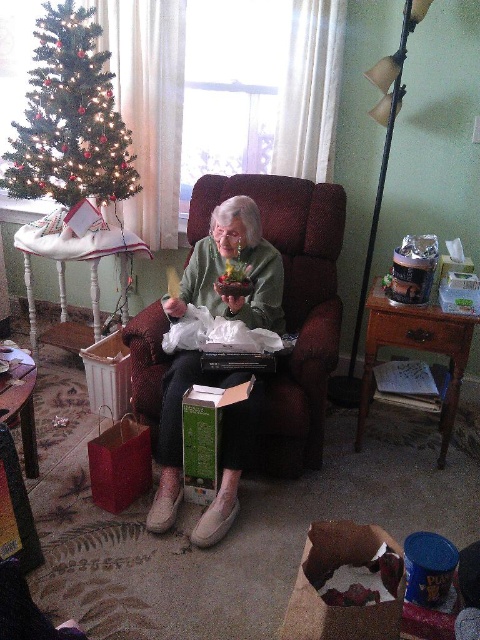
Is brown paper bag at lower center further to the viewer compared to white wood stool at left?

That is False.

Does point (344, 572) come in front of point (104, 228)?

Yes.

Describe the element at coordinates (347, 584) in the screenshot. I see `brown paper bag at lower center` at that location.

This screenshot has height=640, width=480. Identify the location of brown paper bag at lower center. (347, 584).

Does green matte christmas tree at upper left have a larger size compared to brown paper bag at lower center?

Correct, green matte christmas tree at upper left is larger in size than brown paper bag at lower center.

Is green matte christmas tree at upper left thinner than brown paper bag at lower center?

No.

The width and height of the screenshot is (480, 640). I want to click on green matte christmas tree at upper left, so click(70, 118).

Between velvet-like burgundy armchair at center and white wood stool at left, which one appears on the right side from the viewer's perspective?

velvet-like burgundy armchair at center is more to the right.

Who is higher up, velvet-like burgundy armchair at center or white wood stool at left?

white wood stool at left is higher up.

Measure the distance between point (257, 193) and camera.

2.58 meters

The width and height of the screenshot is (480, 640). I want to click on velvet-like burgundy armchair at center, so click(290, 307).